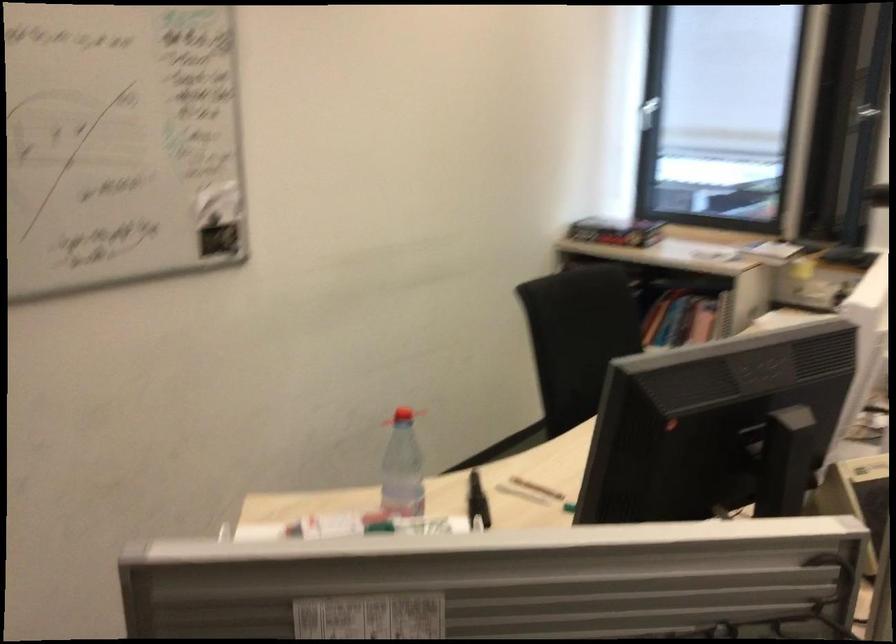
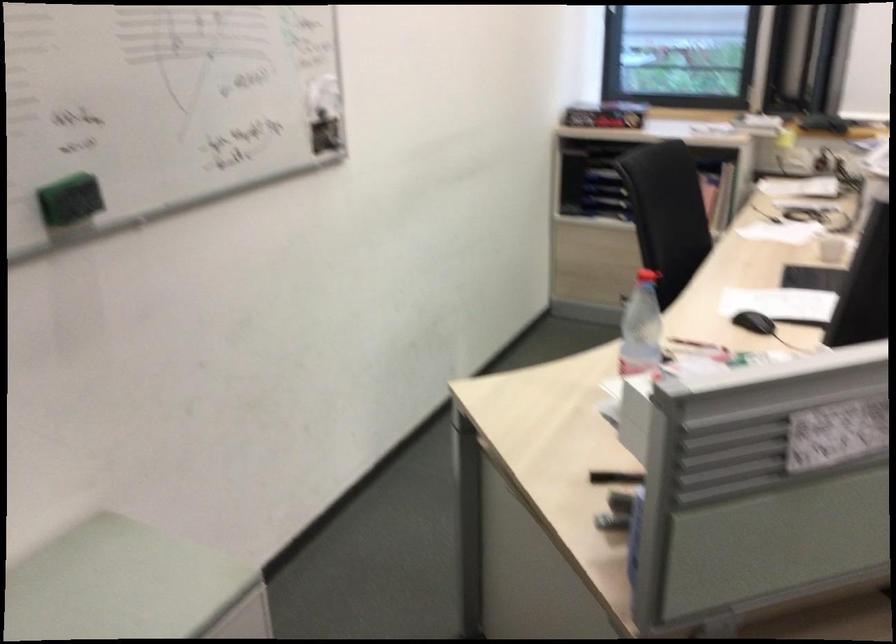
Question: What movement of the cameraman would produce the second image?

Choices:
 (A) Left
 (B) Right
 (C) Forward
 (D) Backward

Answer: (A)